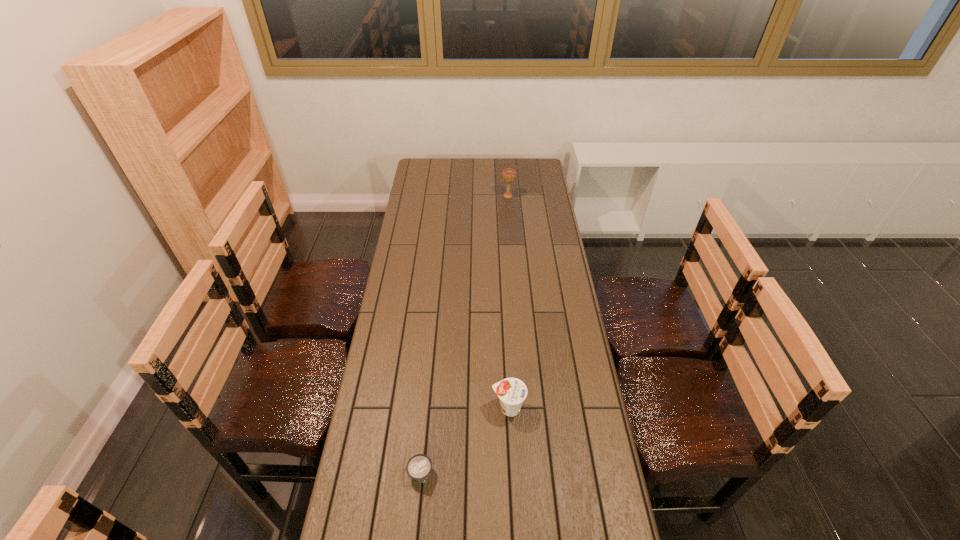
The width and height of the screenshot is (960, 540). Find the location of `blank space at the far edge of the desktop`. blank space at the far edge of the desktop is located at coordinates (463, 158).

Where is `vacant area at the left edge of the desktop`? The width and height of the screenshot is (960, 540). vacant area at the left edge of the desktop is located at coordinates (393, 280).

The width and height of the screenshot is (960, 540). I want to click on free space at the right edge of the desktop, so click(586, 440).

The width and height of the screenshot is (960, 540). Identify the location of vacant space at the far left corner. (429, 171).

I want to click on empty location between the shorter yogurt and the chalice, so click(465, 335).

Find the location of a particular element. The image size is (960, 540). vacant point located between the leftmost object and the second tallest object is located at coordinates (465, 441).

You are a GUI agent. You are given a task and a screenshot of the screen. Output one action in this format:
    pyautogui.click(x=<x>, y=<y>)
    Task: Click on the vacant area that lies between the farther yogurt and the tallest object
    
    Given the screenshot: What is the action you would take?
    [x=508, y=302]

In order to click on free space between the chalice and the right yogurt in this screenshot , I will do `click(508, 302)`.

Find the location of a particular element. This screenshot has width=960, height=540. unoccupied area between the chalice and the taller yogurt is located at coordinates (508, 302).

Find the location of a particular element. Image resolution: width=960 pixels, height=540 pixels. blank region between the right yogurt and the farthest object is located at coordinates (508, 302).